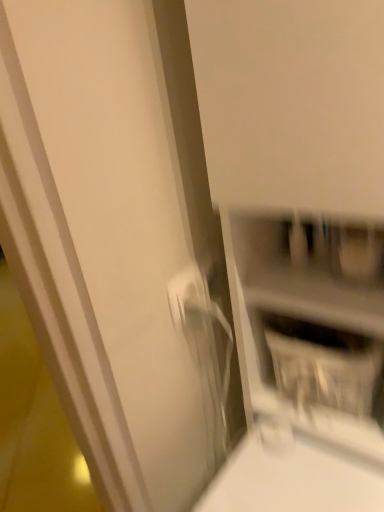
Question: From a real-world perspective, is white glossy electric outlet at center physically located above or below white glossy shelf at center?

Choices:
 (A) above
 (B) below

Answer: (A)

Question: From the image's perspective, is white glossy electric outlet at center located above or below white glossy shelf at center?

Choices:
 (A) below
 (B) above

Answer: (B)

Question: In terms of size, does white glossy electric outlet at center appear bigger or smaller than white glossy shelf at center?

Choices:
 (A) small
 (B) big

Answer: (A)

Question: Considering the positions of white glossy shelf at center and white glossy electric outlet at center in the image, is white glossy shelf at center taller or shorter than white glossy electric outlet at center?

Choices:
 (A) short
 (B) tall

Answer: (B)

Question: Would you say white glossy shelf at center is to the left or to the right of white glossy electric outlet at center in the picture?

Choices:
 (A) right
 (B) left

Answer: (A)

Question: Considering the positions of white glossy shelf at center and white glossy electric outlet at center in the image, is white glossy shelf at center wider or thinner than white glossy electric outlet at center?

Choices:
 (A) thin
 (B) wide

Answer: (B)

Question: Considering the positions of point (231, 279) and point (168, 292), is point (231, 279) closer or farther from the camera than point (168, 292)?

Choices:
 (A) farther
 (B) closer

Answer: (B)